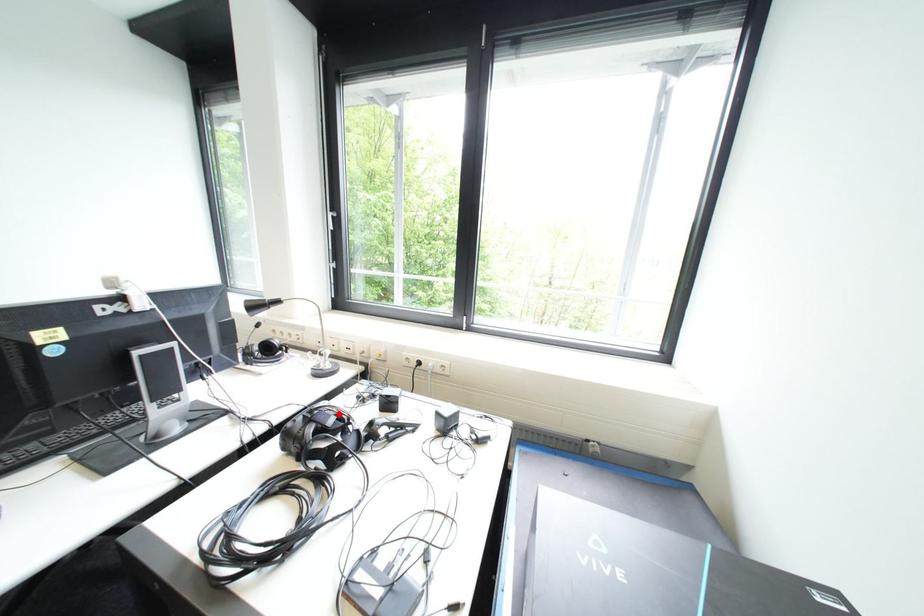
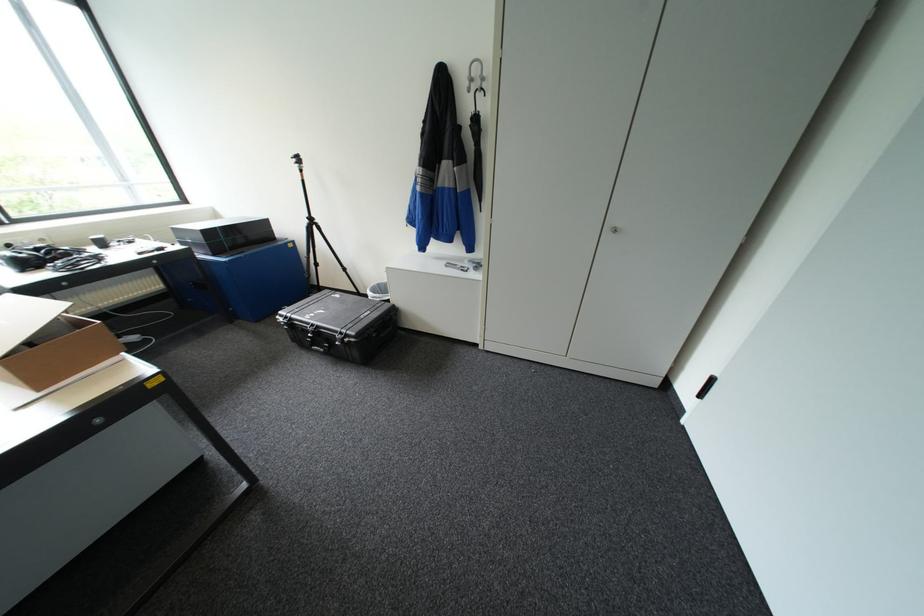
Question: I am providing you with two images of the same scene from different viewpoints. A red point is marked on the first image. Can you still see the location of the red point in image 2?

Choices:
 (A) Yes
 (B) No

Answer: (B)